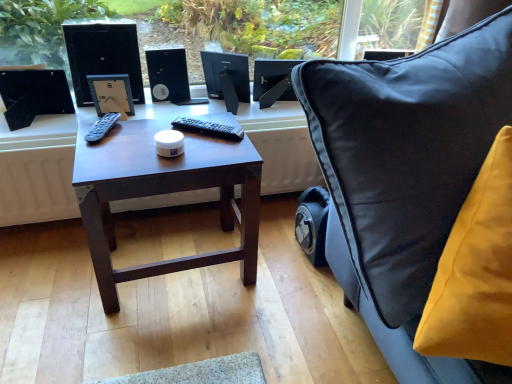
Find the location of a particular element. This screenshot has width=512, height=384. vacant area in front of satin black monitor at upper center, the second computer monitor in the left-to-right sequence is located at coordinates (274, 117).